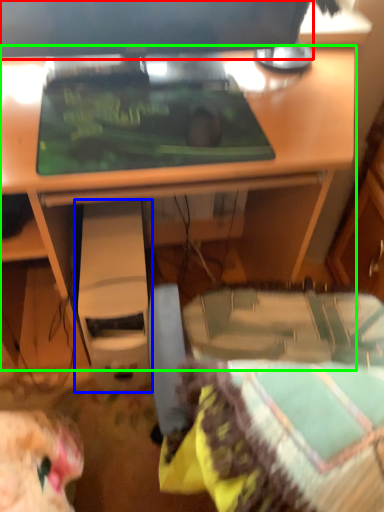
Question: Considering the real-world distances, which object is farthest from computer monitor (highlighted by a red box)? computer (highlighted by a blue box) or desk (highlighted by a green box)?

Choices:
 (A) computer
 (B) desk

Answer: (A)